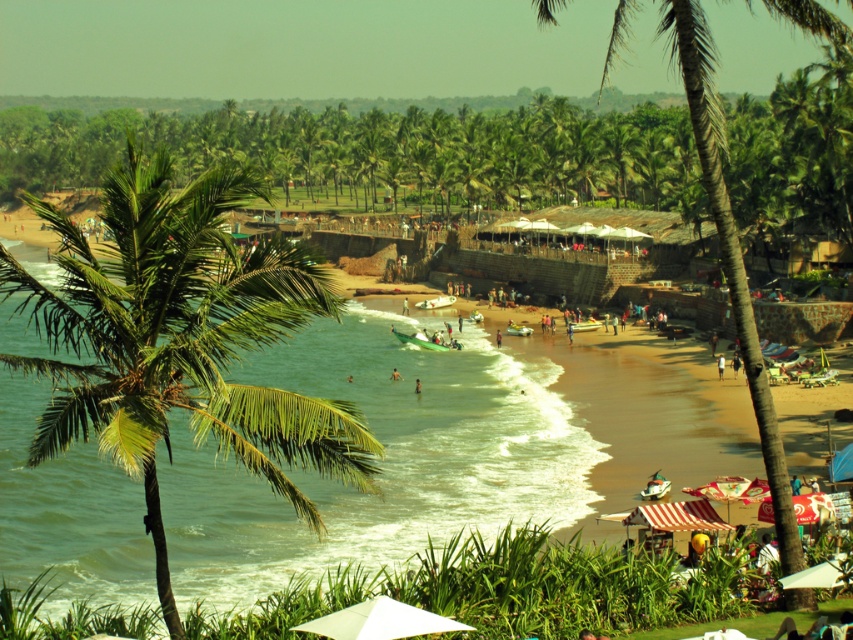
Between point (256, 385) and point (415, 388), which one is positioned in front?

Point (256, 385)

Is green leafy palm tree at left to the left of dark skin human at center from the viewer's perspective?

Indeed, green leafy palm tree at left is positioned on the left side of dark skin human at center.

Image resolution: width=853 pixels, height=640 pixels. What do you see at coordinates (180, 340) in the screenshot?
I see `green leafy palm tree at left` at bounding box center [180, 340].

At what (x,y) coordinates should I click in order to perform the action: click on green leafy palm tree at left. Please return your answer as a coordinate pair (x, y). Looking at the image, I should click on (180, 340).

Is green leafy palm tree at center taller than white matte umbrella at lower center?

Yes, green leafy palm tree at center is taller than white matte umbrella at lower center.

Can you confirm if green leafy palm tree at center is smaller than white matte umbrella at lower center?

Incorrect, green leafy palm tree at center is not smaller in size than white matte umbrella at lower center.

Who is more forward, (614, 49) or (395, 602)?

Point (395, 602)

I want to click on green leafy palm tree at center, so click(729, 246).

Does green leafy palm tree at left appear under skinny person at center?

Incorrect, green leafy palm tree at left is not positioned below skinny person at center.

Does green leafy palm tree at left have a greater height compared to skinny person at center?

Correct, green leafy palm tree at left is much taller as skinny person at center.

Who is more forward, (126, 444) or (393, 378)?

Positioned in front is point (126, 444).

This screenshot has width=853, height=640. I want to click on green leafy palm tree at left, so click(x=180, y=340).